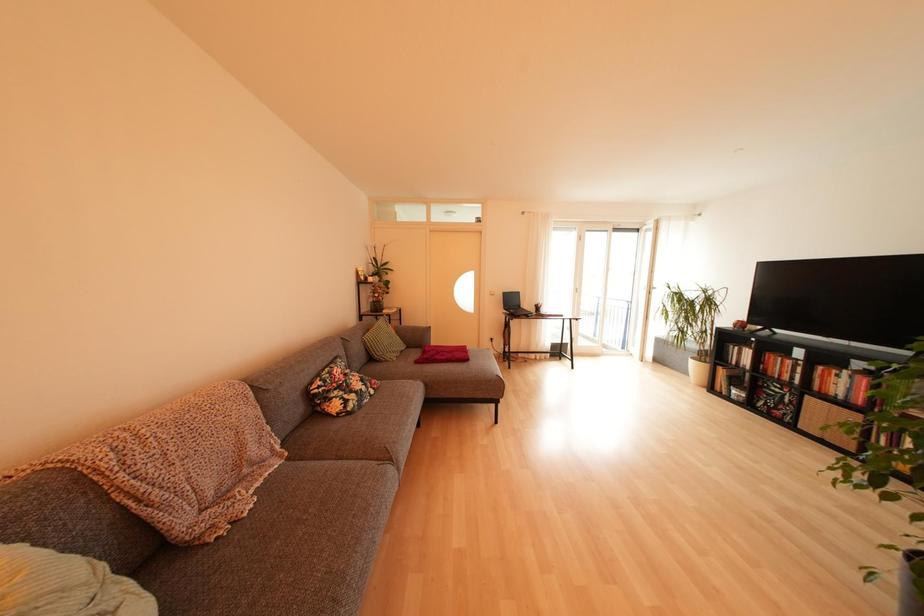
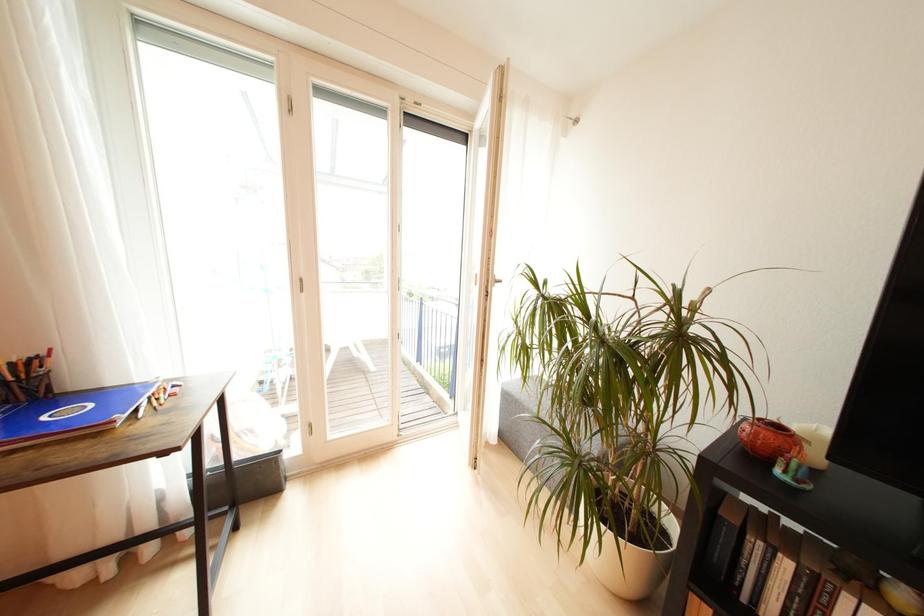
In a continuous first-person perspective shot, in which direction is the camera moving?

The cameraman walked toward right, forward.